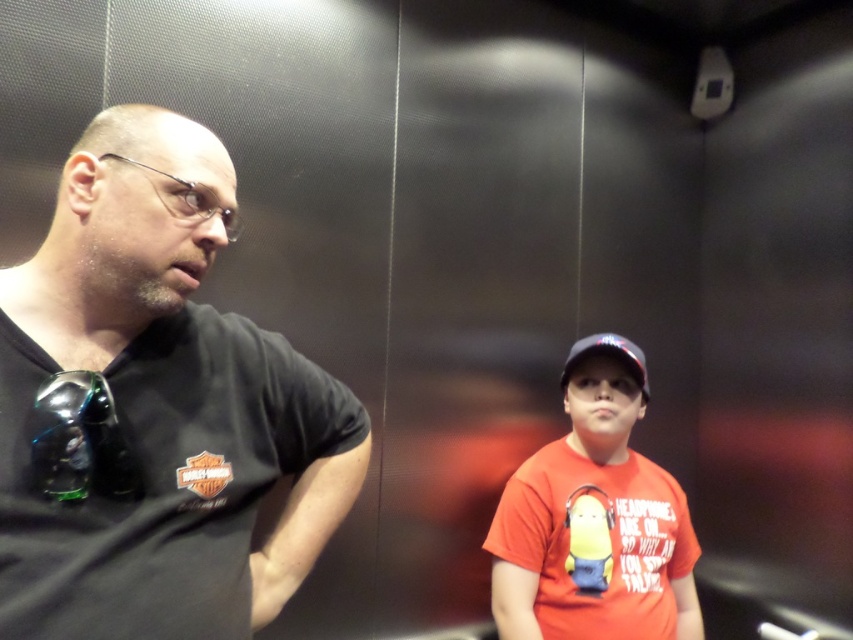
Between orange matte t-shirt at center and black fabric baseball cap at upper right, which one has less height?

With less height is black fabric baseball cap at upper right.

Does point (627, 506) come in front of point (567, 355)?

Yes.

Is point (538, 554) closer to viewer compared to point (631, 372)?

Yes, point (538, 554) is in front of point (631, 372).

What are the coordinates of `orange matte t-shirt at center` in the screenshot? It's located at (595, 518).

Does black matte shirt at left appear over orange matte t-shirt at center?

Indeed, black matte shirt at left is positioned over orange matte t-shirt at center.

Who is more forward, (224, 426) or (590, 552)?

Positioned in front is point (224, 426).

At what (x,y) coordinates should I click in order to perform the action: click on black matte shirt at left. Please return your answer as a coordinate pair (x, y). Looking at the image, I should click on (158, 406).

Is black matte shirt at left thinner than black fabric baseball cap at upper right?

Result: Incorrect, black matte shirt at left's width is not less than black fabric baseball cap at upper right's.

Does black matte shirt at left appear over black fabric baseball cap at upper right?

Yes, black matte shirt at left is above black fabric baseball cap at upper right.

Is point (178, 307) positioned in front of point (633, 358)?

Yes.

Find the location of a particular element. black matte shirt at left is located at coordinates (158, 406).